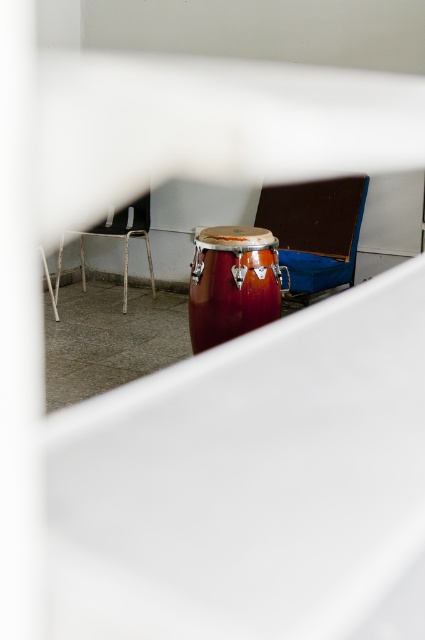
You are standing in a room and see a wooden chair at center and a metallic silver chair at upper left. Which chair is closer to the ceiling?

The wooden chair at center is closer to the ceiling because it is located above the metallic silver chair at upper left.

You are trying to decide which chair to sit on in the room. The wooden chair at center and the metallic silver chair at upper left are both available. Which chair is shorter?

The wooden chair at center is shorter than the metallic silver chair at upper left.

You are trying to decide which chair to sit on in the room. The wooden chair at center and the metallic silver chair at upper left are both available. Based on their size, which chair would you choose if you prefer a smaller seating option?

The wooden chair at center occupies less space than the metallic silver chair at upper left, so you should choose the wooden chair at center for a smaller seating option.